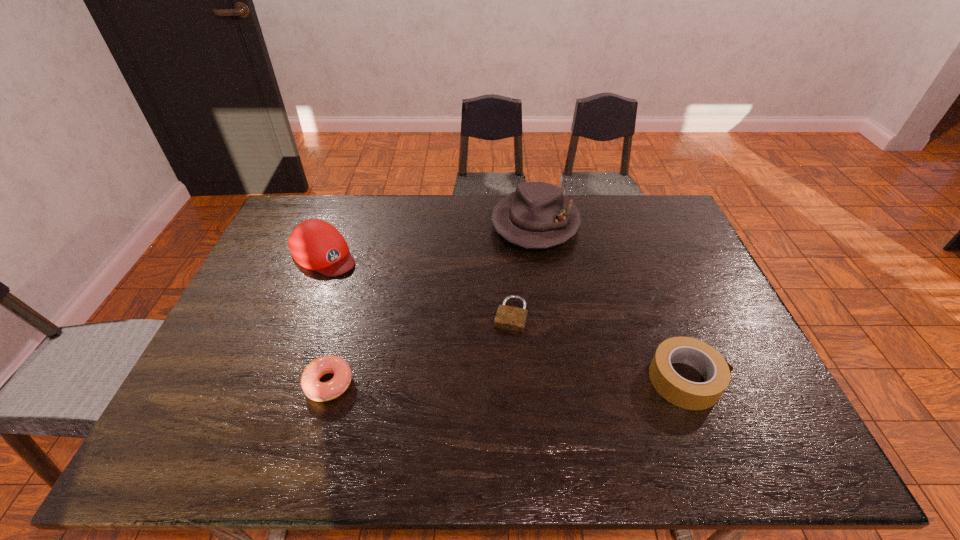
The width and height of the screenshot is (960, 540). In order to click on free space located on the keyhole side of the shortest object in this screenshot , I will do 489,399.

The image size is (960, 540). What are the coordinates of `vacant space located 0.070m on the decorative side of the tallest object` in the screenshot? It's located at (523, 269).

Where is `vacant region located 0.370m on the decorative side of the tallest object`? vacant region located 0.370m on the decorative side of the tallest object is located at coordinates (501, 344).

Find the location of a particular element. vacant position located on the decorative side of the tallest object is located at coordinates (517, 289).

Locate an element on the screen. This screenshot has width=960, height=540. free space located on the front-facing side of the baseball cap is located at coordinates (421, 334).

At what (x,y) coordinates should I click in order to perform the action: click on vacant space positioned on the front-facing side of the baseball cap. Please return your answer as a coordinate pair (x, y). This screenshot has width=960, height=540. Looking at the image, I should click on 426,339.

This screenshot has width=960, height=540. In order to click on vacant space located 0.090m on the front-facing side of the baseball cap in this screenshot , I will do `click(361, 284)`.

Locate an element on the screen. Image resolution: width=960 pixels, height=540 pixels. hat at the far edge is located at coordinates (537, 215).

Identify the location of baseball cap present at the far edge. (315, 244).

Where is `doughnut present at the near edge`? This screenshot has height=540, width=960. doughnut present at the near edge is located at coordinates [x=318, y=391].